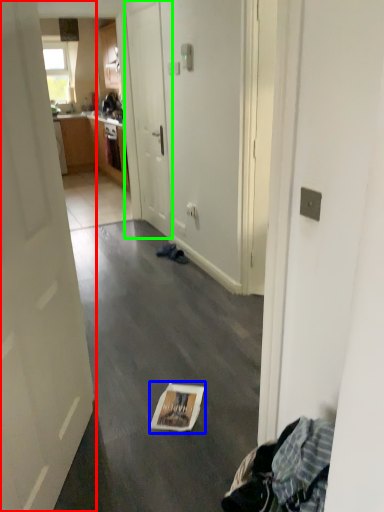
Question: Which object is positioned closest to door (highlighted by a red box)? Select from magazine (highlighted by a blue box) and door (highlighted by a green box).

Choices:
 (A) magazine
 (B) door

Answer: (A)